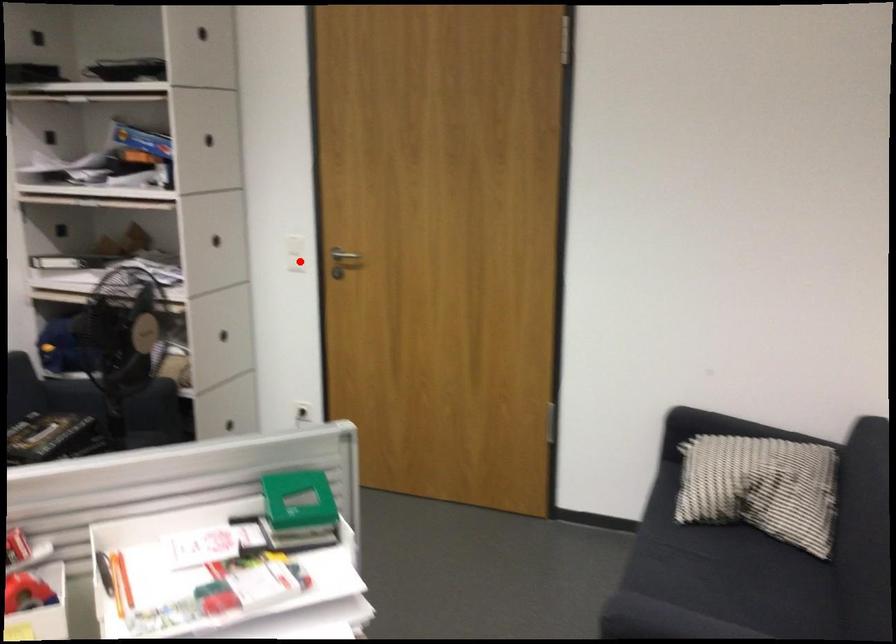
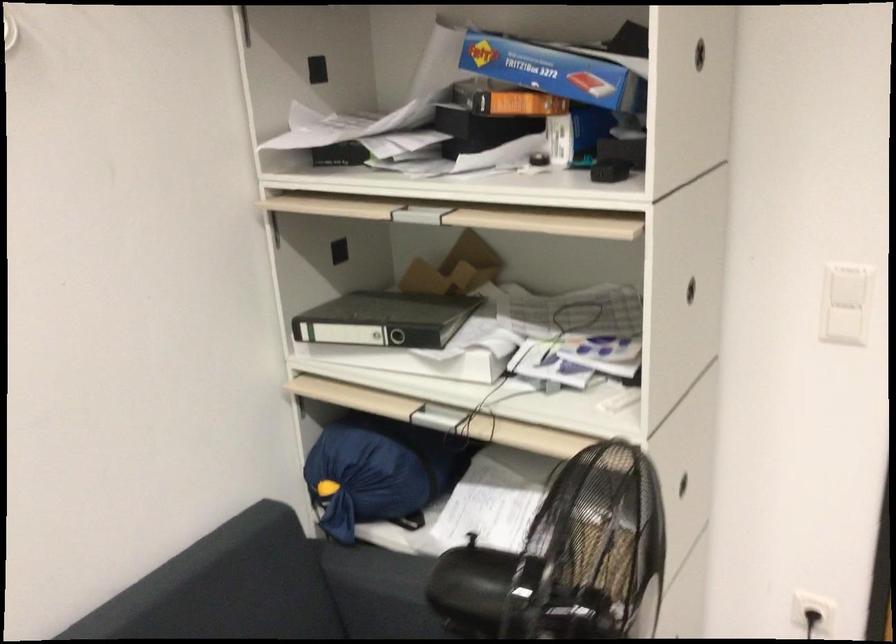
Question: I am providing you with two images of the same scene from different viewpoints. Image1 has a red point marked. In image2, the corresponding 3D location appears at what relative position? Reply with the corresponding letter.

Choices:
 (A) Closer
 (B) Farther

Answer: (A)